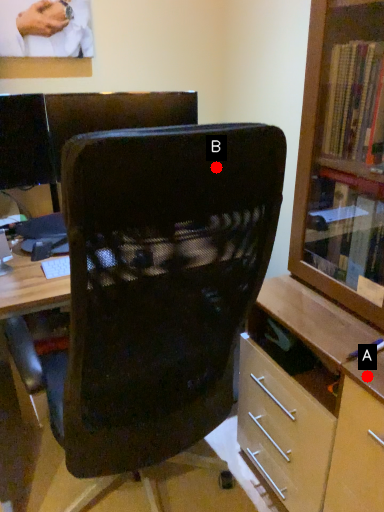
Question: Two points are circled on the image, labeled by A and B beside each circle. Which of the following is the farthest from the observer?

Choices:
 (A) A is further
 (B) B is further

Answer: (A)